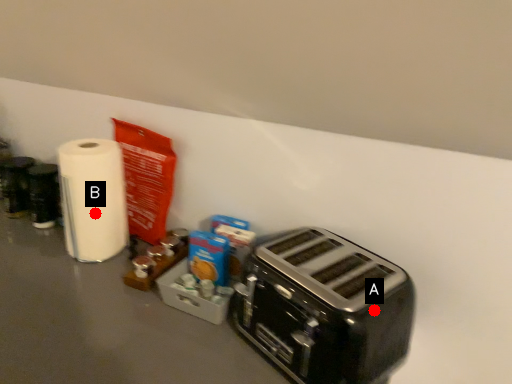
Question: Two points are circled on the image, labeled by A and B beside each circle. Which point is closer to the camera?

Choices:
 (A) A is closer
 (B) B is closer

Answer: (A)